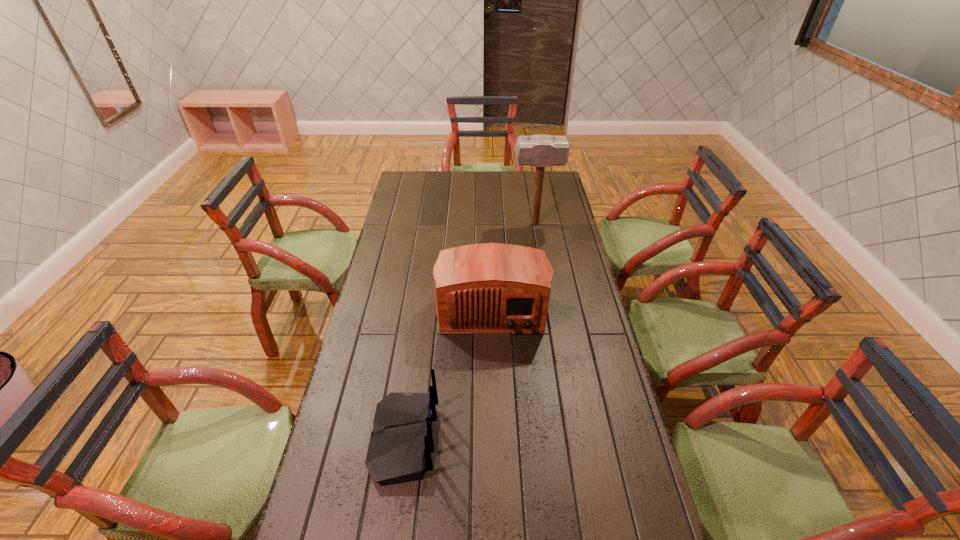
The height and width of the screenshot is (540, 960). I want to click on free space that satisfies the following two spatial constraints: 1. on the striking face of the tallest object; 2. on the front-facing side of the second tallest object, so click(548, 305).

Where is `free location that satisfies the following two spatial constraints: 1. on the striking face of the farthest object; 2. on the front-facing side of the second farthest object`? free location that satisfies the following two spatial constraints: 1. on the striking face of the farthest object; 2. on the front-facing side of the second farthest object is located at coordinates (548, 305).

Where is `vacant space that satisfies the following two spatial constraints: 1. on the front-facing side of the second farthest object; 2. on the back of the shortest object`? This screenshot has height=540, width=960. vacant space that satisfies the following two spatial constraints: 1. on the front-facing side of the second farthest object; 2. on the back of the shortest object is located at coordinates (495, 439).

This screenshot has height=540, width=960. Find the location of `vacant space that satisfies the following two spatial constraints: 1. on the striking face of the mallet; 2. on the front-facing side of the radio receiver`. vacant space that satisfies the following two spatial constraints: 1. on the striking face of the mallet; 2. on the front-facing side of the radio receiver is located at coordinates (548, 305).

Locate an element on the screen. Image resolution: width=960 pixels, height=540 pixels. free space that satisfies the following two spatial constraints: 1. on the front-facing side of the radio receiver; 2. on the back of the router is located at coordinates (495, 439).

Locate an element on the screen. free spot that satisfies the following two spatial constraints: 1. on the front-facing side of the radio receiver; 2. on the back of the router is located at coordinates (495, 439).

You are a GUI agent. You are given a task and a screenshot of the screen. Output one action in this format:
    pyautogui.click(x=<x>, y=<y>)
    Task: Click on the vacant space that satisfies the following two spatial constraints: 1. on the front-facing side of the radio receiver; 2. on the back of the router
    
    Given the screenshot: What is the action you would take?
    pyautogui.click(x=495, y=439)